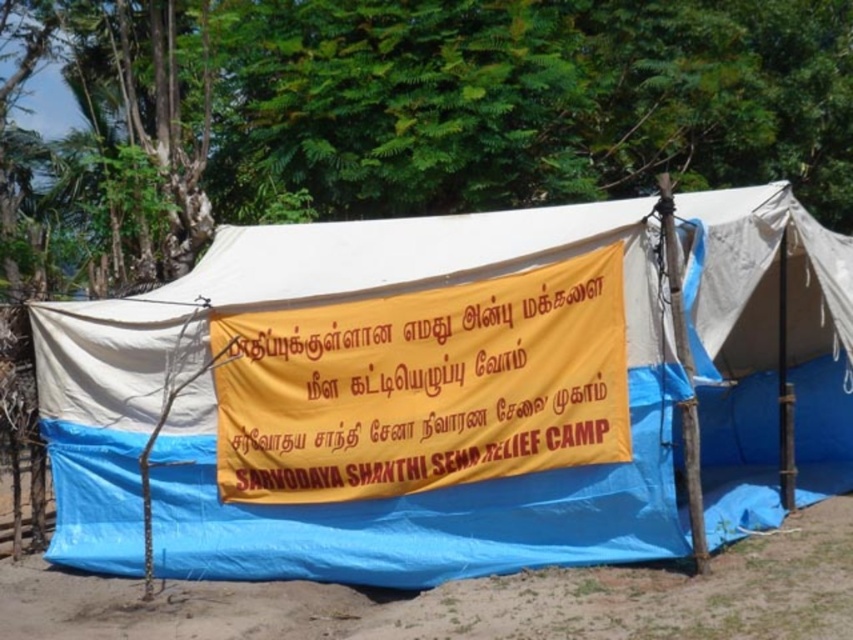
You are a relief worker trying to set up a new tent. You have a blue tarpaulin tent at center and a green leafy tree at upper center in your view. Which object is positioned to the right side of the other?

The blue tarpaulin tent at center is to the right of the green leafy tree at upper center.

You are a relief worker carrying a 10 meter long supply rope. You need to secure the yellow banner to both the green leafy tree at upper center and the brown dirt field at lower center. Is the rope long enough to reach between them?

The distance between the green leafy tree at upper center and the brown dirt field at lower center is 13.78 meters. Since the rope is only 10 meters long, it is not long enough to span the distance between them.

What are the coordinates of the blue tarpaulin tent at center in the image?

The coordinates of the blue tarpaulin tent at center are at point (445, 394).